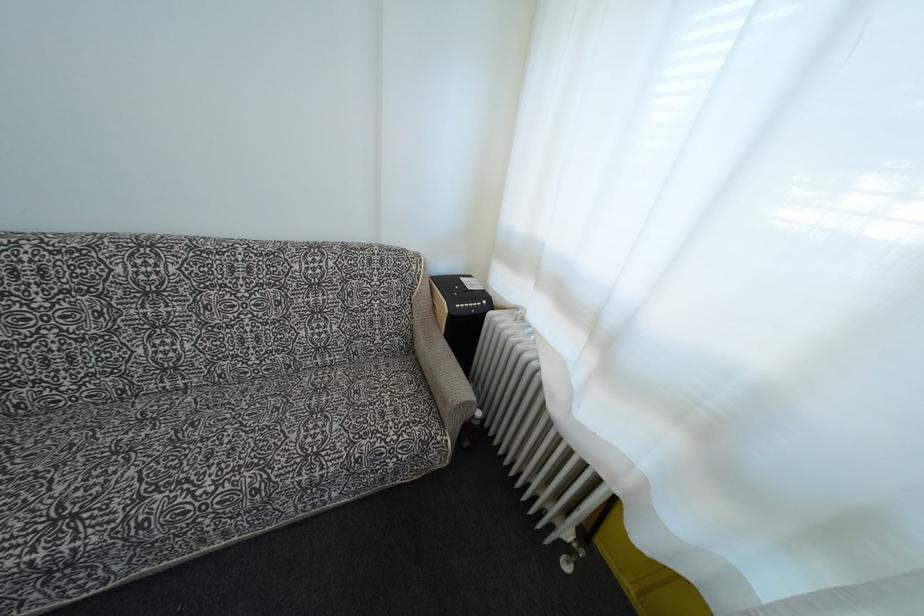
Image resolution: width=924 pixels, height=616 pixels. Identify the location of sofa armrest. (441, 371).